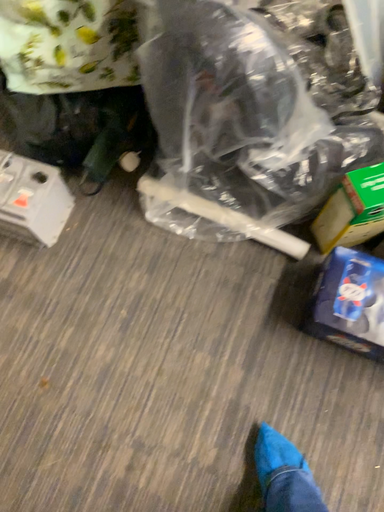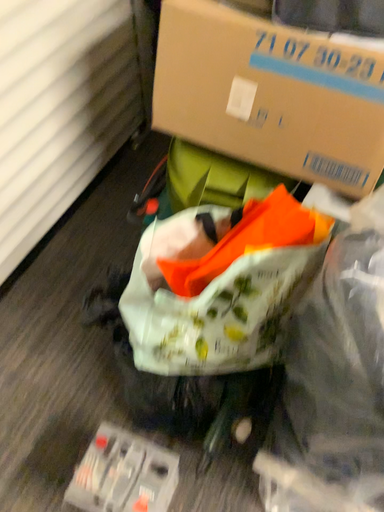
Question: Which way did the camera rotate in the video?

Choices:
 (A) rotated downward
 (B) rotated upward

Answer: (B)